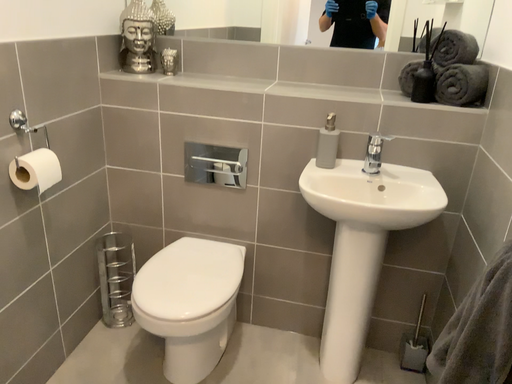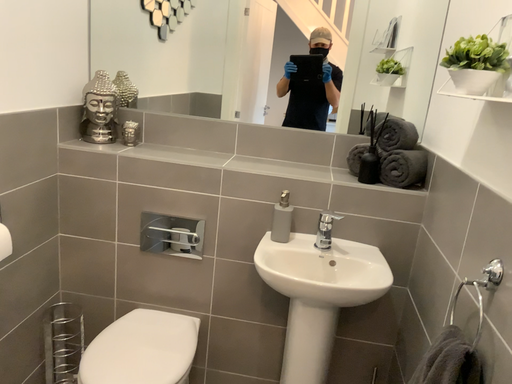
Question: How did the camera likely rotate when shooting the video?

Choices:
 (A) rotated upward
 (B) rotated downward

Answer: (A)